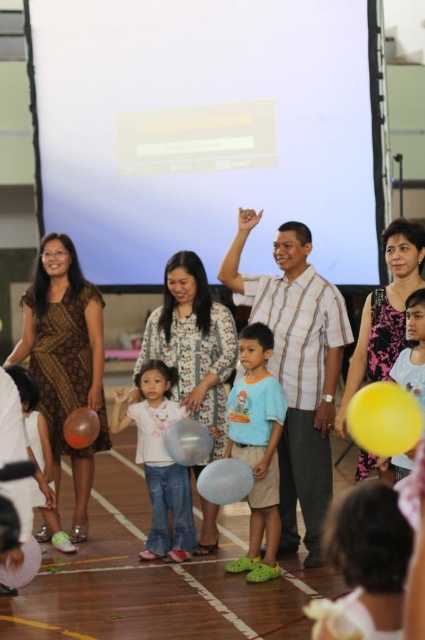
Question: Which object is positioned closest to the translucent white balloon at center?

Choices:
 (A) white matte projection screen at upper center
 (B) translucent yellow balloon at center
 (C) light blue cotton shirt at center

Answer: (C)

Question: Is plaid shirt at center to the right of light blue cotton shirt at center from the viewer's perspective?

Choices:
 (A) yes
 (B) no

Answer: (A)

Question: Is translucent white balloon at center positioned in front of translucent plastic balloon at center?

Choices:
 (A) yes
 (B) no

Answer: (A)

Question: Which object is the closest to the matte pink dress at center?

Choices:
 (A) matte white shirt at center
 (B) white matte shirt at center

Answer: (B)

Question: Estimate the real-world distances between objects in this image. Which object is closer to the translucent white balloon at center?

Choices:
 (A) light blue cotton shirt at center
 (B) translucent yellow balloon at center
 (C) matte pink dress at center
 (D) white matte shirt at center

Answer: (A)

Question: Does matte white shirt at center have a smaller size compared to translucent yellow balloon at lower left?

Choices:
 (A) no
 (B) yes

Answer: (A)